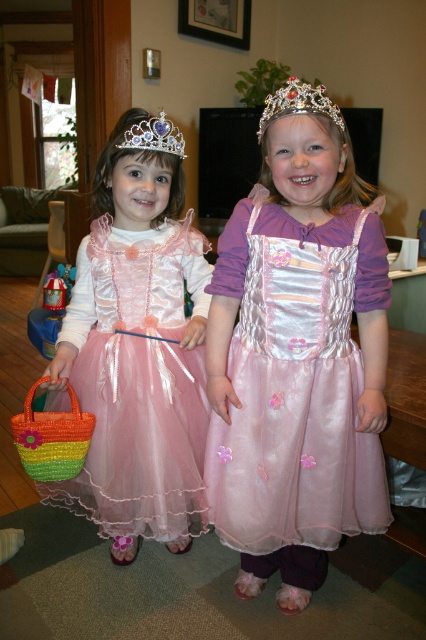
Question: Can you confirm if pink satin dress at center is positioned to the left of silver metallic crown at upper center?

Choices:
 (A) no
 (B) yes

Answer: (A)

Question: Which point is closer to the camera taking this photo?

Choices:
 (A) (54, 433)
 (B) (169, 150)

Answer: (A)

Question: Among these objects, which one is nearest to the camera?

Choices:
 (A) pink satin dress at center
 (B) rainbow woven basket at lower left
 (C) pink tulle dress at left
 (D) silver metallic crown at upper center

Answer: (A)

Question: Which point is farther from the camera taking this photo?

Choices:
 (A) (150, 404)
 (B) (313, 467)
 (C) (71, 468)
 (D) (328, 113)

Answer: (A)

Question: Can you confirm if rainbow woven basket at lower left is wider than silver metallic crown at upper center?

Choices:
 (A) no
 (B) yes

Answer: (B)

Question: Does silver/crystal tiara at upper center appear over silver metallic crown at upper center?

Choices:
 (A) yes
 (B) no

Answer: (B)